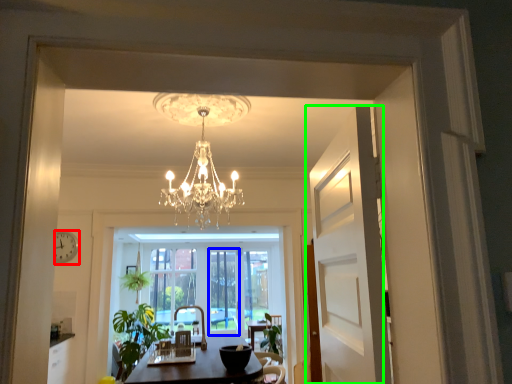
Question: Based on their relative distances, which object is farther from clock (highlighted by a red box)? Choose from window screen (highlighted by a blue box) and door (highlighted by a green box).

Choices:
 (A) window screen
 (B) door

Answer: (B)